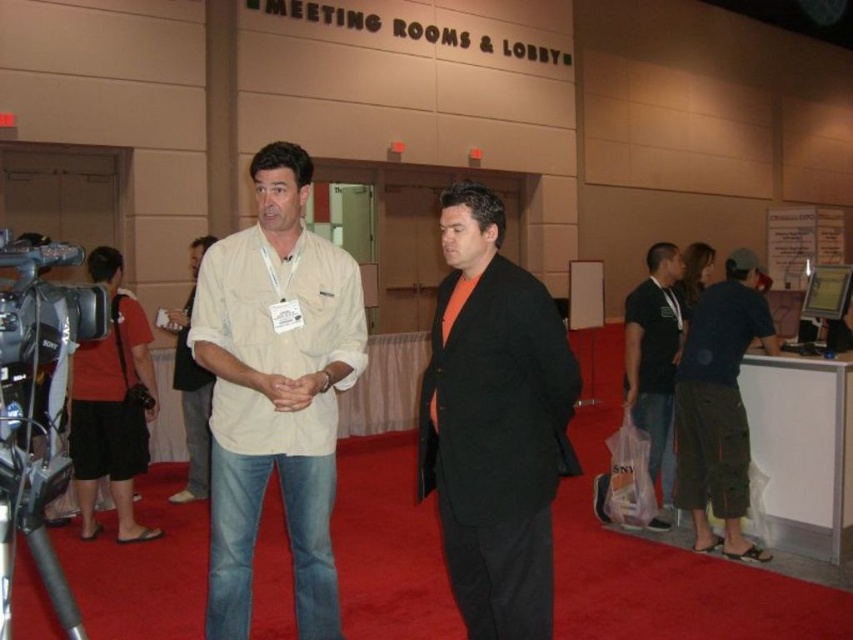
Question: Does beige cotton shirt at center have a larger size compared to dark green cargo pants at right?

Choices:
 (A) yes
 (B) no

Answer: (B)

Question: Can you confirm if beige cotton shirt at center is bigger than silver metallic video camera at left?

Choices:
 (A) no
 (B) yes

Answer: (B)

Question: Considering the real-world distances, which object is closest to the orange cotton shirt at center?

Choices:
 (A) dark green cargo pants at right
 (B) beige cotton shirt at center
 (C) black cotton shirt at right
 (D) silver metallic video camera at left

Answer: (B)

Question: In this image, where is beige cotton shirt at center located relative to dark green cargo pants at right?

Choices:
 (A) below
 (B) above

Answer: (B)

Question: Estimate the real-world distances between objects in this image. Which object is closer to the orange cotton shirt at center?

Choices:
 (A) dark green cargo pants at right
 (B) beige cotton shirt at center
 (C) silver metallic video camera at left

Answer: (B)

Question: Which point is closer to the camera?

Choices:
 (A) dark green cargo pants at right
 (B) orange cotton shirt at center
 (C) beige cotton shirt at center
 (D) black cotton shirt at right

Answer: (B)